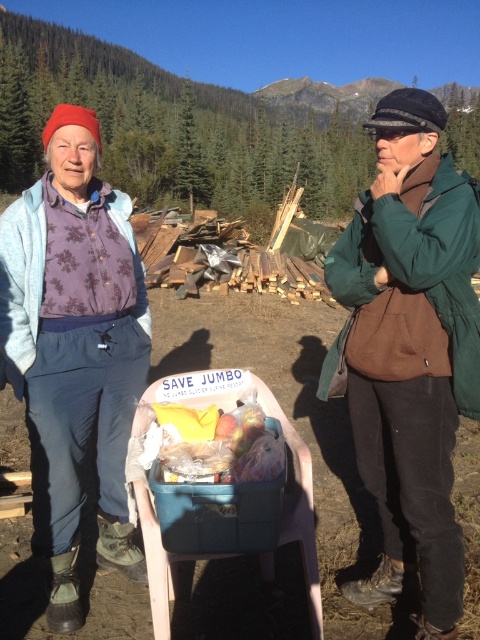
Is green fuzzy jacket at right smaller than floral fabric shirt at center?

Actually, green fuzzy jacket at right might be larger than floral fabric shirt at center.

At what (x,y) coordinates should I click in order to perform the action: click on green fuzzy jacket at right. Please return your answer as a coordinate pair (x, y). The image size is (480, 640). Looking at the image, I should click on (411, 349).

Who is positioned more to the left, floral fabric shirt at center or translucent plastic bag at center?

Positioned to the left is floral fabric shirt at center.

Is point (137, 381) positioned after point (219, 470)?

Yes.

Locate an element on the screen. The height and width of the screenshot is (640, 480). floral fabric shirt at center is located at coordinates (74, 349).

How much distance is there between green fuzzy jacket at right and translucent plastic bag at center?

The distance of green fuzzy jacket at right from translucent plastic bag at center is 29.32 inches.

Can you confirm if green fuzzy jacket at right is smaller than translucent plastic bag at center?

No, green fuzzy jacket at right is not smaller than translucent plastic bag at center.

Identify the location of green fuzzy jacket at right. This screenshot has width=480, height=640. (411, 349).

At what (x,y) coordinates should I click in order to perform the action: click on green fuzzy jacket at right. Please return your answer as a coordinate pair (x, y). The image size is (480, 640). Looking at the image, I should click on (411, 349).